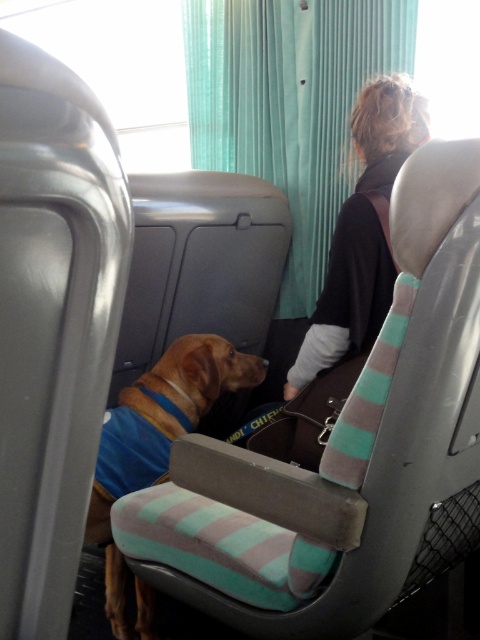
You are a passenger on a train and want to place a small bag on the seat next to the dog. The seat has a striped pattern in shades of teal, gray, and white. Where should you place the bag to avoid the dog? Please specify the coordinates based on the image grid system where the dog is at point (x=361, y=232).

The point (x=361, y=232) marks dark brown hair at upper right, so placing the bag away from that coordinate on the striped seat would avoid the dog.

You are a passenger on a train and need to decide whether to place your bag on the teal fabric curtain at upper center or the striped fabric lap at center. Based on their heights, which one is suitable for placing a bag?

The teal fabric curtain at upper center is taller than the striped fabric lap at center, so placing the bag on the teal fabric curtain at upper center would be more suitable as it provides a higher surface for placement.